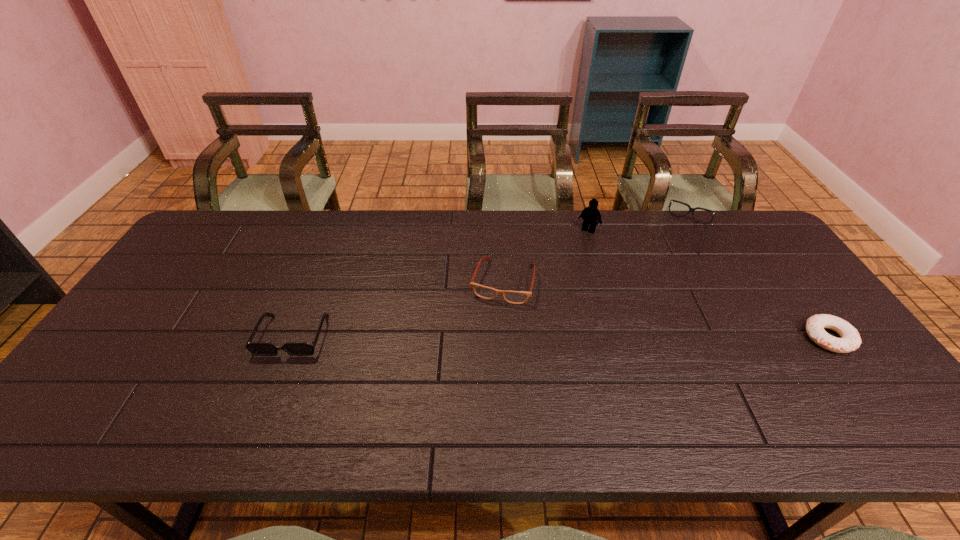
The height and width of the screenshot is (540, 960). In order to click on free spot on the desktop that is between the leftmost object and the doughnut and is positioned on the front-facing side of the nearer spectacles in this screenshot , I will do `click(487, 336)`.

Where is `free spot on the desktop that is between the sunglasses and the doughnut and is positioned on the face of the third object from right to left`? Image resolution: width=960 pixels, height=540 pixels. free spot on the desktop that is between the sunglasses and the doughnut and is positioned on the face of the third object from right to left is located at coordinates (520, 336).

Image resolution: width=960 pixels, height=540 pixels. Find the location of `vacant space on the desktop that is between the leftmost object and the shortest object and is positioned with the lenses facing outward on the second object from right to left`. vacant space on the desktop that is between the leftmost object and the shortest object and is positioned with the lenses facing outward on the second object from right to left is located at coordinates (636, 337).